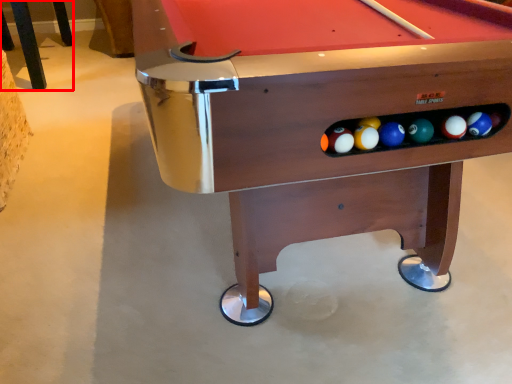
Question: In this image, where is furniture (annotated by the red box) located relative to billiard table?

Choices:
 (A) left
 (B) right

Answer: (A)